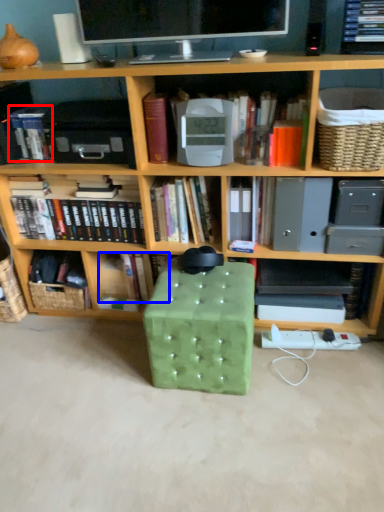
Question: Which point is further to the camera, book (highlighted by a red box) or book (highlighted by a blue box)?

Choices:
 (A) book
 (B) book

Answer: (B)